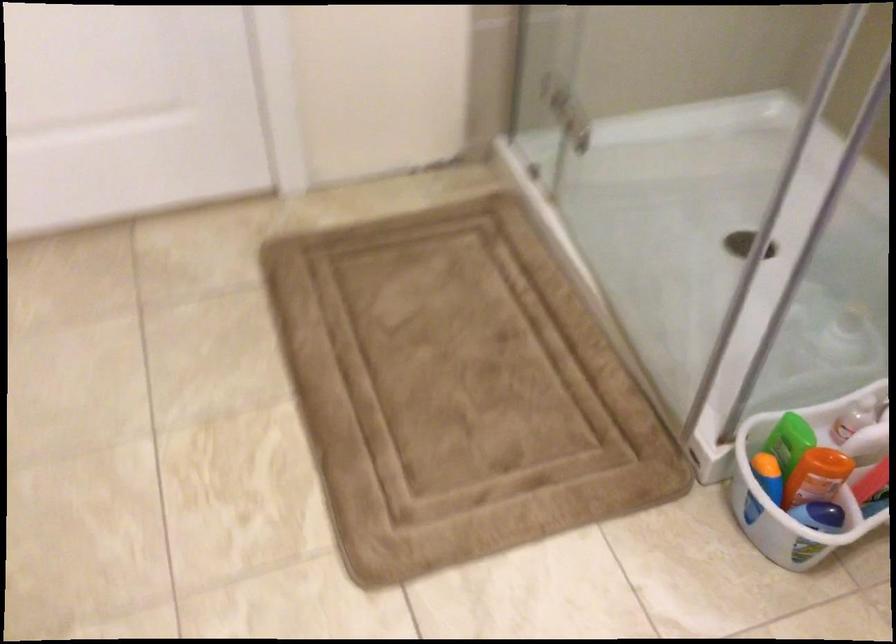
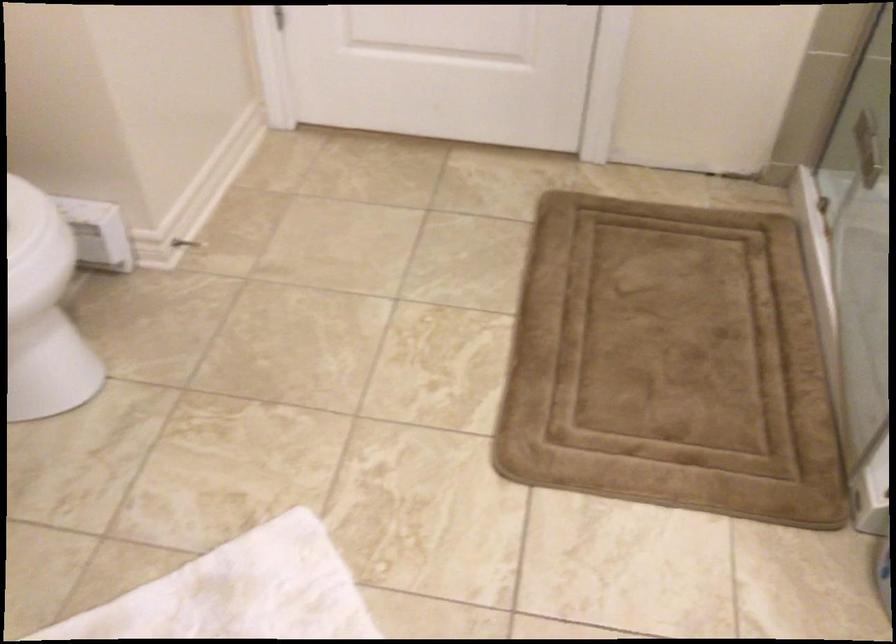
In the second image, find the point that corresponds to point 471,386 in the first image.

(670, 363)